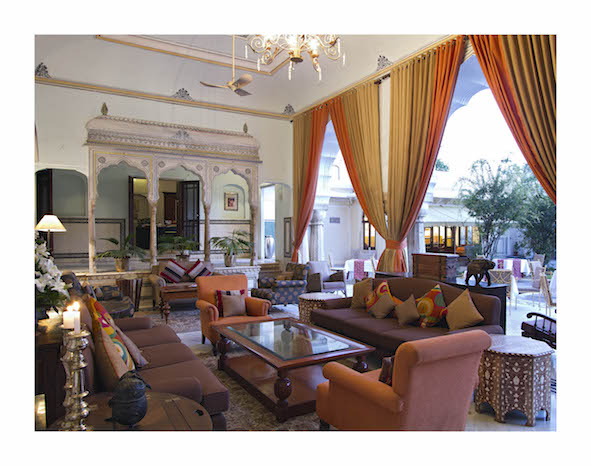
This screenshot has height=466, width=591. What are the coordinates of `candles` in the screenshot? It's located at (67, 318), (77, 318).